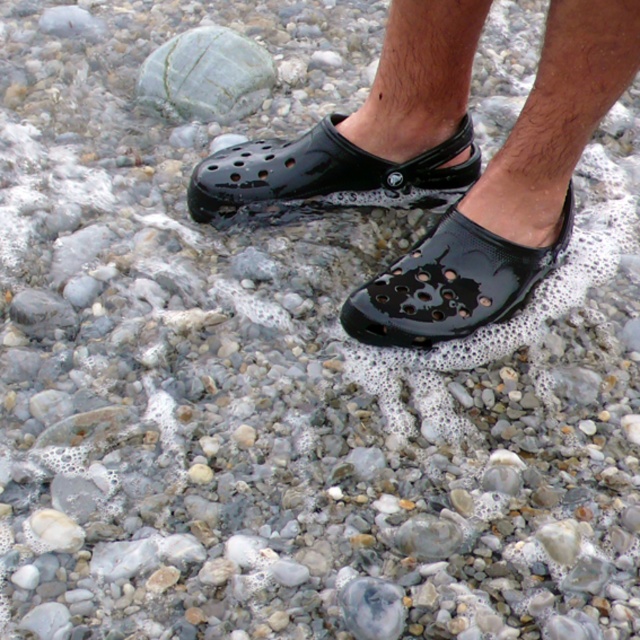
You are a photographer trying to capture the black rubber clog at center and the glossy black clog at center in a single shot. Since your camera can only focus on one object at a time, which clog should you focus on first if you want to include both in the frame?

You should focus on the black rubber clog at center first because it is positioned to the left of the glossy black clog at center, allowing you to adjust the focus to include both in the frame.

You are a photographer trying to capture the glossy plastic shoes at center and the glossy black clog at center in the same frame. Based on their positions, which object should you focus on first to ensure both are in focus?

The glossy plastic shoes at center is above the glossy black clog at center, so you should focus on the glossy plastic shoes at center first to ensure both are in focus.

You are a photographer setting up a shot of the glossy plastic shoes at center and the green marble rock at upper left. You need to ensure both objects are in focus. The camera you are using has a depth of field that can sharply focus on objects within 15 inches of each other. Will both objects be in focus?

The glossy plastic shoes at center and green marble rock at upper left are 15.11 inches apart from each other. Since the distance between them is slightly more than the camera can handle, the objects will not both be in focus.